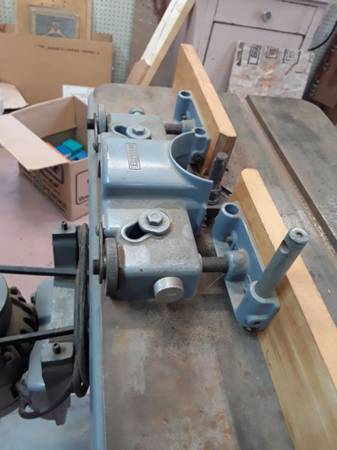
Where is `knob`? The width and height of the screenshot is (337, 450). knob is located at coordinates 268,16.